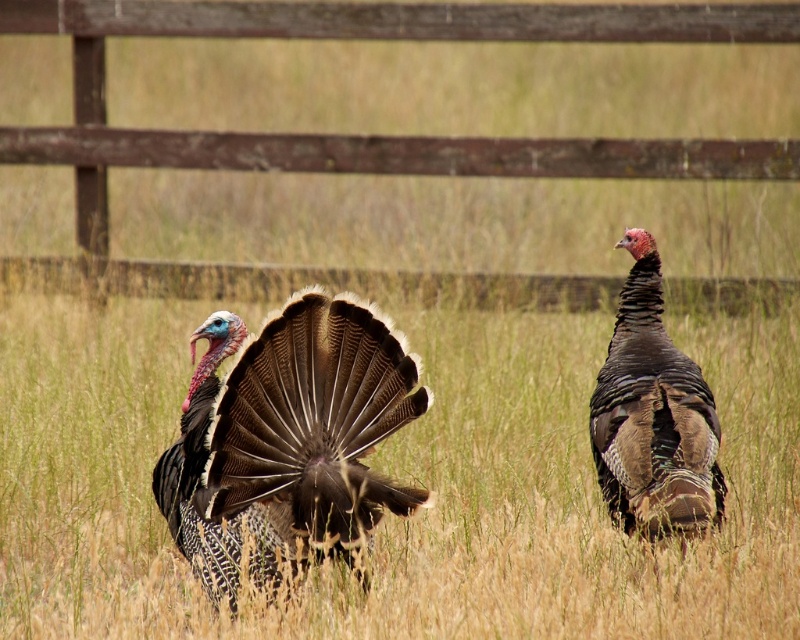
You are a photographer aiming to capture both the wooden fence at upper center and the dark brown feathers at right in the same frame. Based on their sizes in the image, which object would appear taller in the photo?

The wooden fence at upper center would appear taller in the photo since it has a greater height compared to the dark brown feathers at right.

You are a wildlife photographer trying to capture a photo of the shiny brown turkey at center and the dark brown feathers at right. Since you want to highlight the size difference between them, which turkey should you focus on to make the shiny brown turkey appear bigger in the photo?

To emphasize the size difference, focus on the shiny brown turkey at center because it is larger than the dark brown feathers at right.

You are a photographer trying to capture the shiny brown turkey at center. The wooden fence at upper center is in your way. Can you move closer to the turkey without moving the fence?

The shiny brown turkey at center is behind the wooden fence at upper center, so moving closer to the turkey would require moving behind the fence as well, but since the fence is part of the background and likely stationary, you cannot move closer to the turkey without also moving the fence, which is not possible. Therefore, you cannot move closer to the shiny brown turkey at center without moving the fence.